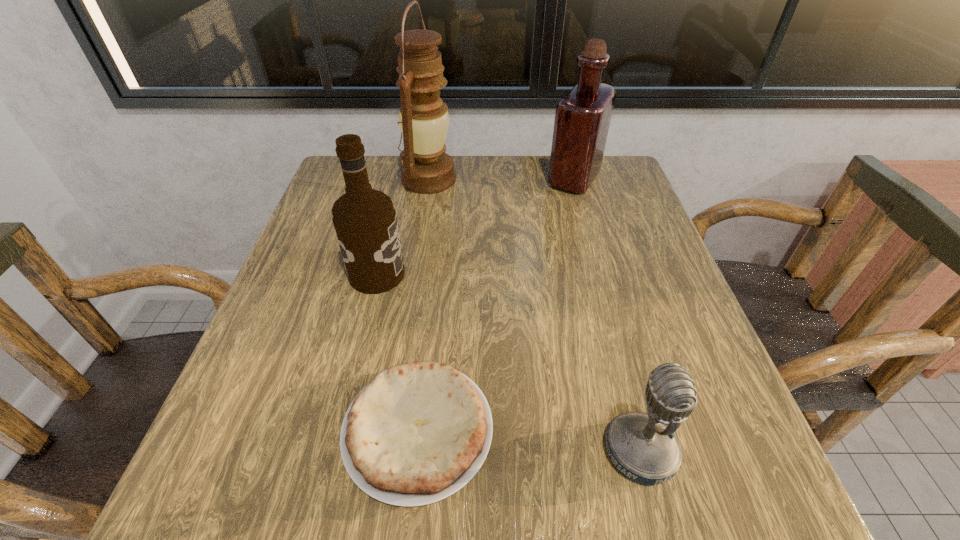
You are a GUI agent. You are given a task and a screenshot of the screen. Output one action in this format:
    pyautogui.click(x=<x>, y=<y>)
    Task: Click on the free location that satisfies the following two spatial constraints: 1. on the label of the tortilla; 2. on the right side of the third nearest object
    The height and width of the screenshot is (540, 960).
    Given the screenshot: What is the action you would take?
    pyautogui.click(x=339, y=430)

Find the location of `free spot that satisfies the following two spatial constraints: 1. on the front side of the liquor; 2. on the label of the alcohol`. free spot that satisfies the following two spatial constraints: 1. on the front side of the liquor; 2. on the label of the alcohol is located at coordinates (601, 274).

Find the location of a particular element. The image size is (960, 540). blank area in the image that satisfies the following two spatial constraints: 1. on the label of the third farthest object; 2. on the left side of the shortest object is located at coordinates (339, 430).

What are the coordinates of `vacant space that satisfies the following two spatial constraints: 1. on the label of the third farthest object; 2. on the back side of the tortilla` in the screenshot? It's located at (339, 430).

Locate an element on the screen. The width and height of the screenshot is (960, 540). vacant space that satisfies the following two spatial constraints: 1. on the back side of the shortest object; 2. on the label of the third nearest object is located at coordinates (435, 274).

I want to click on free space that satisfies the following two spatial constraints: 1. on the front side of the oil lamp; 2. on the label of the alcohol, so click(x=414, y=274).

I want to click on free space that satisfies the following two spatial constraints: 1. on the label of the third nearest object; 2. on the left side of the tortilla, so click(x=339, y=430).